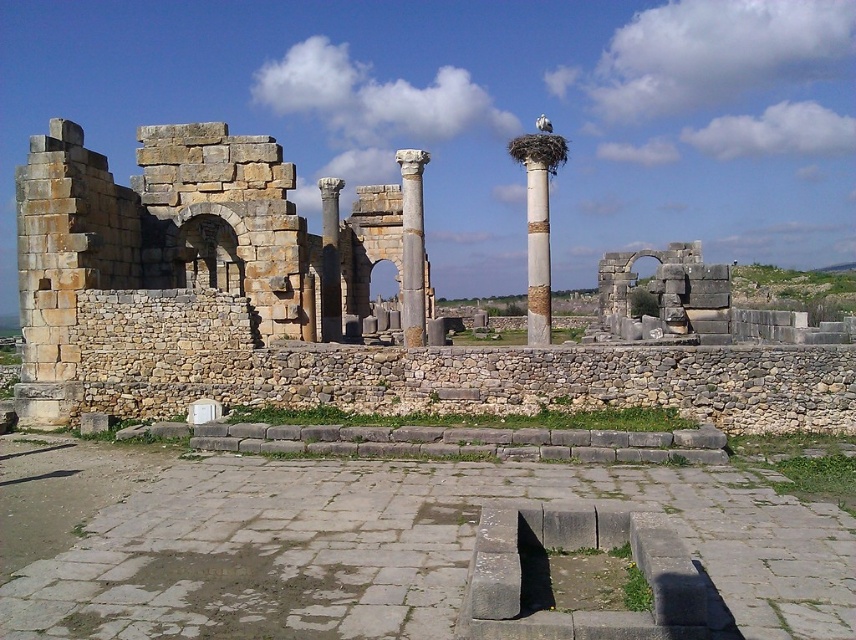
You are standing at the coordinates 0.0, 0.0 in the image. You want to walk straight towards the white marble column at center. What coordinate will you reach when you arrive at the column?

You will reach the coordinate point (538, 253) when you arrive at the white marble column at center.

You are standing in the ancient Roman ruins and want to take a photo of both point (687, 244) and point (548, 243). Which point should you focus on first to ensure both are in clear view?

You should focus on point (548, 243) first because it is closer to you than point (687, 244), which is further away. This will help ensure both points are in focus as the depth of field may capture the farther point as well.